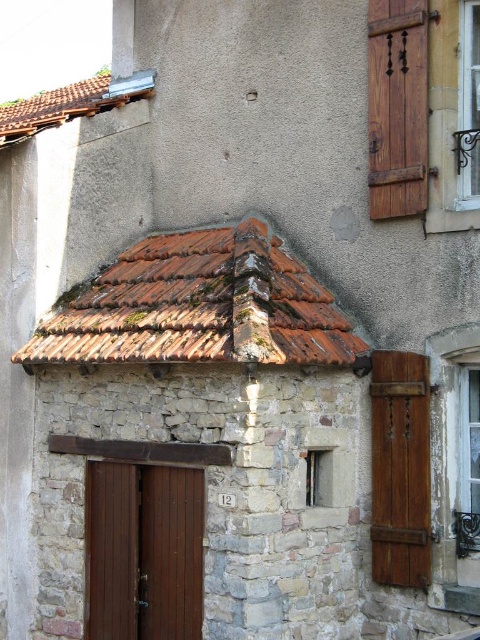
Question: Is brown wooden door at lower left in front of wooden shutter at upper right?

Choices:
 (A) no
 (B) yes

Answer: (A)

Question: Can you confirm if rusty clay tiles at upper center is positioned to the right of rustic wood shutter at upper right?

Choices:
 (A) no
 (B) yes

Answer: (A)

Question: Which point is closer to the camera?

Choices:
 (A) wooden shutter at upper right
 (B) brown wooden door at lower left
 (C) rustic wood shutter at upper right
 (D) rusty clay tiles at upper center

Answer: (D)

Question: Which object is closer to the camera taking this photo?

Choices:
 (A) wooden shutter at upper right
 (B) wooden textured shutter at right

Answer: (A)

Question: Which object is the closest to the rusty clay tiles at upper center?

Choices:
 (A) wooden shutter at upper right
 (B) brown wooden door at lower left
 (C) wooden textured shutter at right

Answer: (C)

Question: In this image, where is rusty clay tiles at upper center located relative to rustic wood shutter at upper right?

Choices:
 (A) above
 (B) below

Answer: (B)